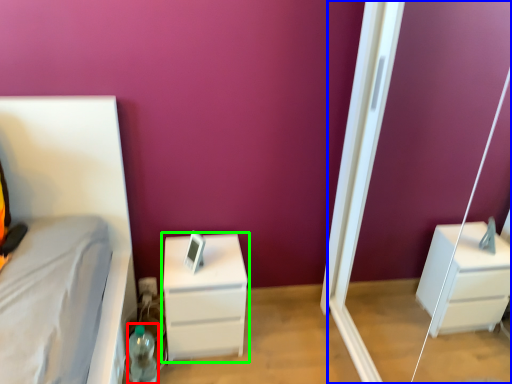
Question: Considering the real-world distances, which object is farthest from bottle (highlighted by a red box)? screen door (highlighted by a blue box) or chest of drawers (highlighted by a green box)?

Choices:
 (A) screen door
 (B) chest of drawers

Answer: (A)